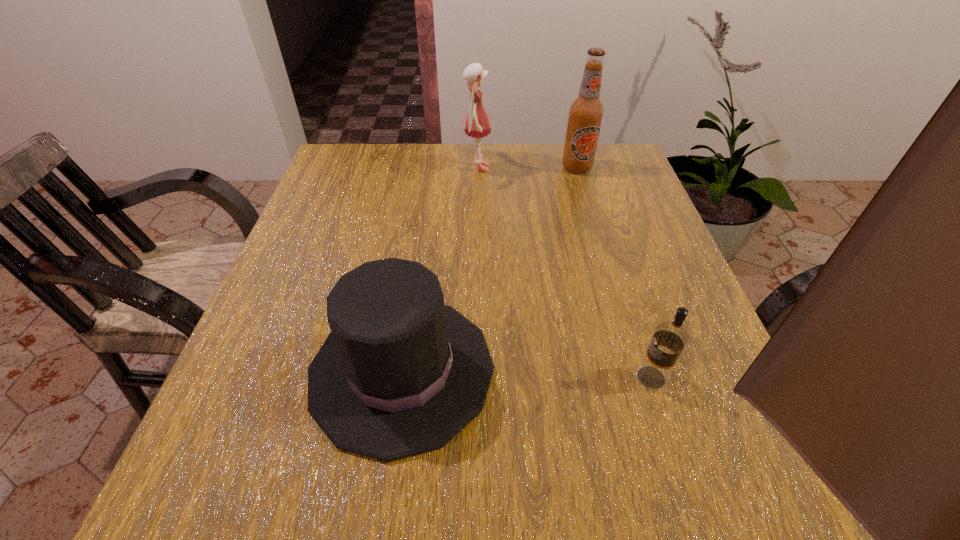
At what (x,y) coordinates should I click in order to perform the action: click on free space between the vodka and the dress hat. Please return your answer as a coordinate pair (x, y). This screenshot has height=540, width=960. Looking at the image, I should click on (526, 374).

This screenshot has width=960, height=540. I want to click on free point between the dress hat and the beer bottle, so pos(490,269).

The width and height of the screenshot is (960, 540). Identify the location of empty space that is in between the dress hat and the vodka. (526, 374).

You are a GUI agent. You are given a task and a screenshot of the screen. Output one action in this format:
    pyautogui.click(x=<x>, y=<y>)
    Task: Click on the free space between the dress hat and the beer bottle
    This screenshot has height=540, width=960.
    Given the screenshot: What is the action you would take?
    pyautogui.click(x=490, y=269)

The image size is (960, 540). I want to click on object that is the second nearest to the doll, so click(x=400, y=373).

Select which object is the second closest to the vodka. Please provide its 2D coordinates. Your answer should be formatted as a tuple, i.e. [(x, y)], where the tuple contains the x and y coordinates of a point satisfying the conditions above.

[(477, 123)]

Where is `free spot that satisfies the following two spatial constraints: 1. on the front label of the beer bottle; 2. on the front of the dress hat with the decoration`? Image resolution: width=960 pixels, height=540 pixels. free spot that satisfies the following two spatial constraints: 1. on the front label of the beer bottle; 2. on the front of the dress hat with the decoration is located at coordinates (636, 370).

The height and width of the screenshot is (540, 960). I want to click on free space that satisfies the following two spatial constraints: 1. on the front label of the beer bottle; 2. on the front of the dress hat with the decoration, so pyautogui.click(x=636, y=370).